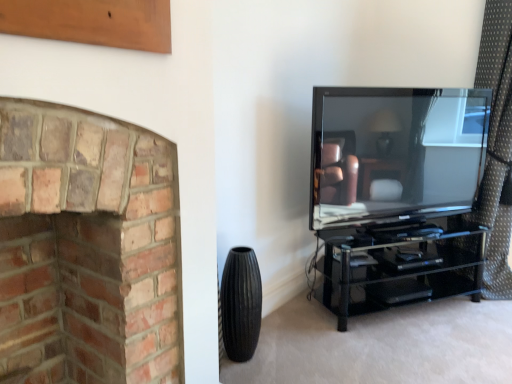
Image resolution: width=512 pixels, height=384 pixels. What are the coordinates of `free space above black ribbed vase at lower center (from a real-world perspective)` in the screenshot? It's located at (240, 257).